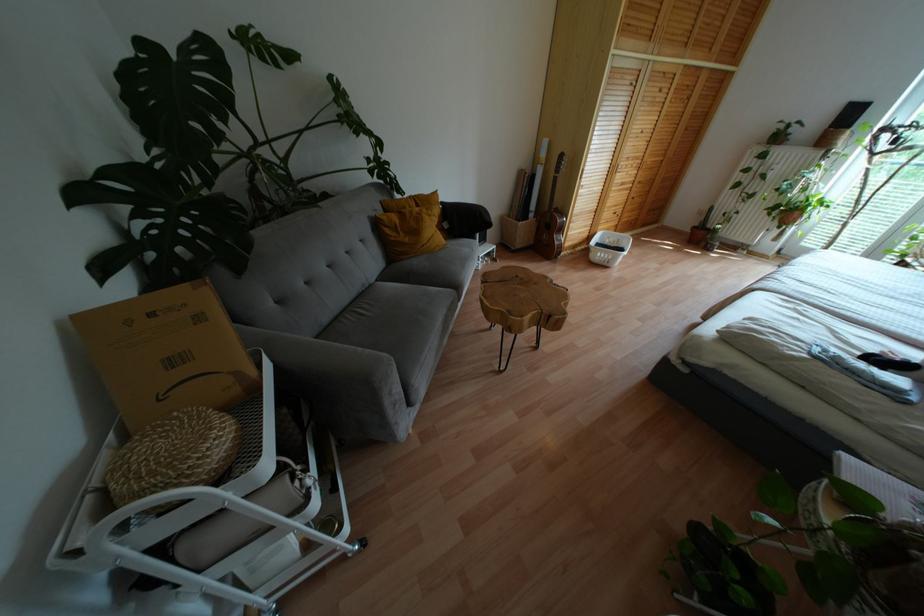
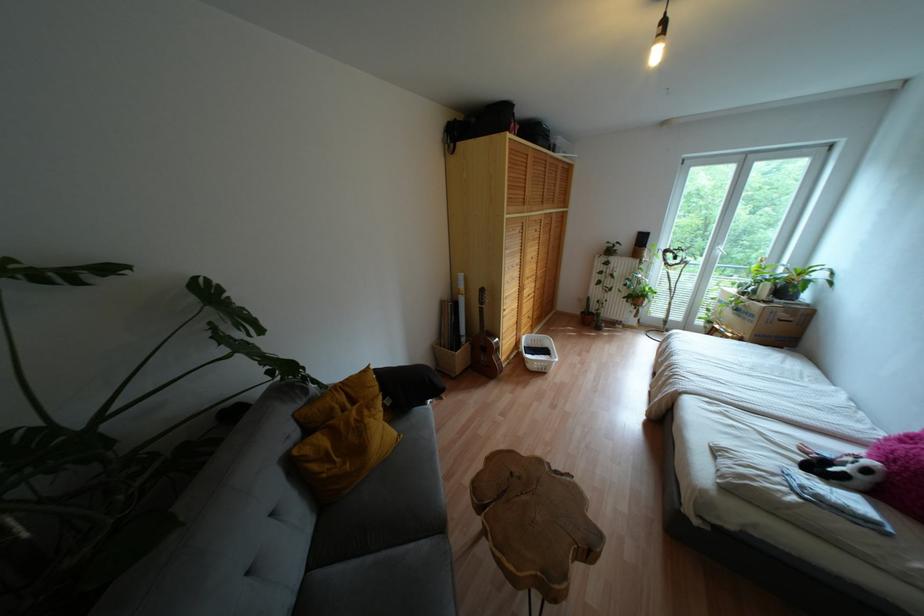
In the second image, find the point that corresponds to point 604,262 in the first image.

(542, 370)